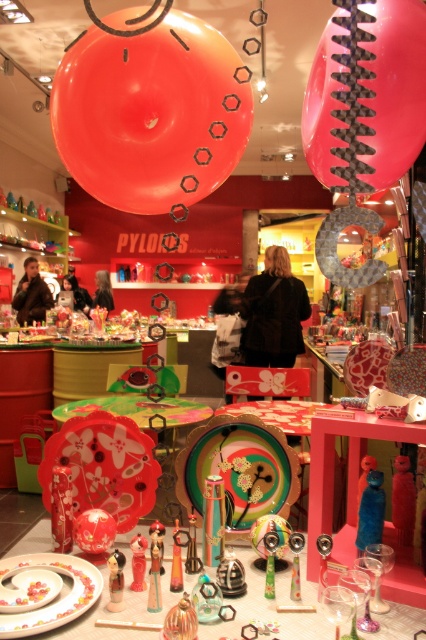
You are a customer in the store looking at the table with items. You want to pick up the metallic silver toy at center but need to reach it from above. Is the matte black hair at center blocking your access to it?

The matte black hair at center is located above the metallic silver toy at center, so it may block your access to the toy when reaching from above.

You are standing in the toy store and want to pick up an item. You notice two points marked in the image. Which point is closer to you, point (x=40, y=321) or point (x=118, y=593)?

Point (x=40, y=321) is closer to you because it is further to the viewer than point (x=118, y=593).

In the scene shown: You are a delivery person who needs to place a new item on the shelf. The shelf has a height limit of 1.5 meters. You have a matte black jacket at left and a translucent glass figurine at center. Can you determine if either of these items will exceed the shelf height limit?

The objects description does not provide information about the height of the matte black jacket at left or the translucent glass figurine at center, so it is impossible to determine if they exceed the shelf height limit of 1.5 meters.